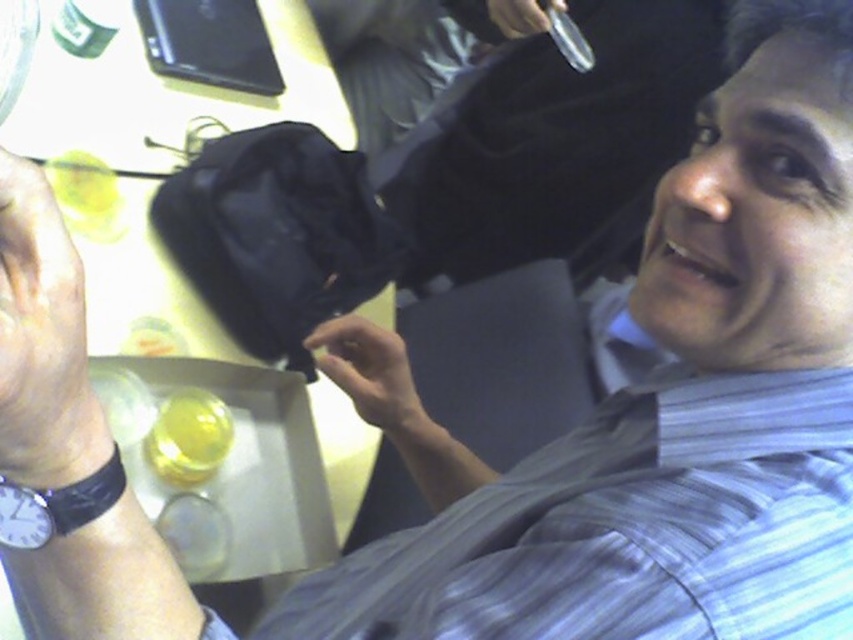
Question: Which point appears farthest from the camera in this image?

Choices:
 (A) (90, 310)
 (B) (386, 396)
 (C) (204, 460)

Answer: (C)

Question: Does dry skin at lower left appear over translucent yellow liquid at center?

Choices:
 (A) no
 (B) yes

Answer: (B)

Question: Which object is closer to the camera taking this photo?

Choices:
 (A) dry skin at lower left
 (B) black fabric bag at center
 (C) matte black hand at center
 (D) translucent yellow liquid at center

Answer: (A)

Question: Can you confirm if dry skin at lower left is bigger than translucent yellow liquid at center?

Choices:
 (A) no
 (B) yes

Answer: (A)

Question: Does white paper at center lie in front of matte black bag at center?

Choices:
 (A) no
 (B) yes

Answer: (B)

Question: Which object is farther from the camera taking this photo?

Choices:
 (A) translucent yellow liquid at center
 (B) dry skin at lower left
 (C) matte black bag at center
 (D) white paper at center

Answer: (C)